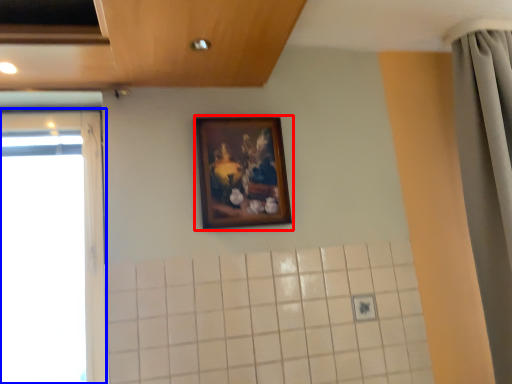
Question: Which of the following is the farthest to the observer, picture frame (highlighted by a red box) or window (highlighted by a blue box)?

Choices:
 (A) picture frame
 (B) window

Answer: (A)